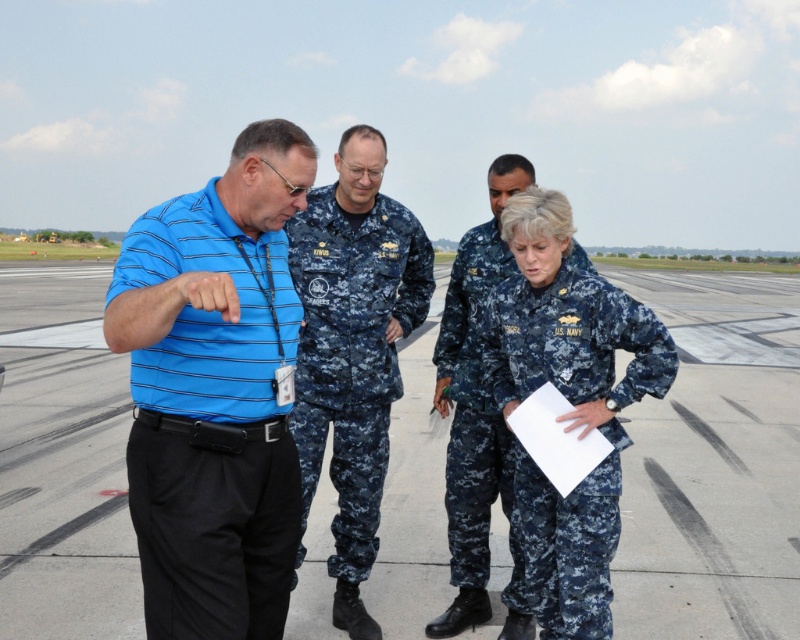
Who is lower down, matte blue uniform at center or navy blue uniform at center?

Positioned lower is navy blue uniform at center.

Between matte blue uniform at center and navy blue uniform at center, which one appears on the right side from the viewer's perspective?

From the viewer's perspective, matte blue uniform at center appears more on the right side.

This screenshot has width=800, height=640. In order to click on matte blue uniform at center in this screenshot , I will do `click(714, 464)`.

Does digital camouflage uniform at center appear over navy blue uniform at center?

Yes.

Between point (320, 384) and point (462, 563), which one is positioned in front?

Point (320, 384) is in front.

Where is `digital camouflage uniform at center`? digital camouflage uniform at center is located at coordinates (352, 353).

Does point (278, 186) lie in front of point (458, 586)?

Yes.

Who is positioned more to the left, blue striped polo shirt at left or navy blue uniform at center?

Positioned to the left is blue striped polo shirt at left.

Measure the distance between blue striped polo shirt at left and camera.

blue striped polo shirt at left is 1.82 meters away from camera.

I want to click on blue striped polo shirt at left, so click(x=214, y=392).